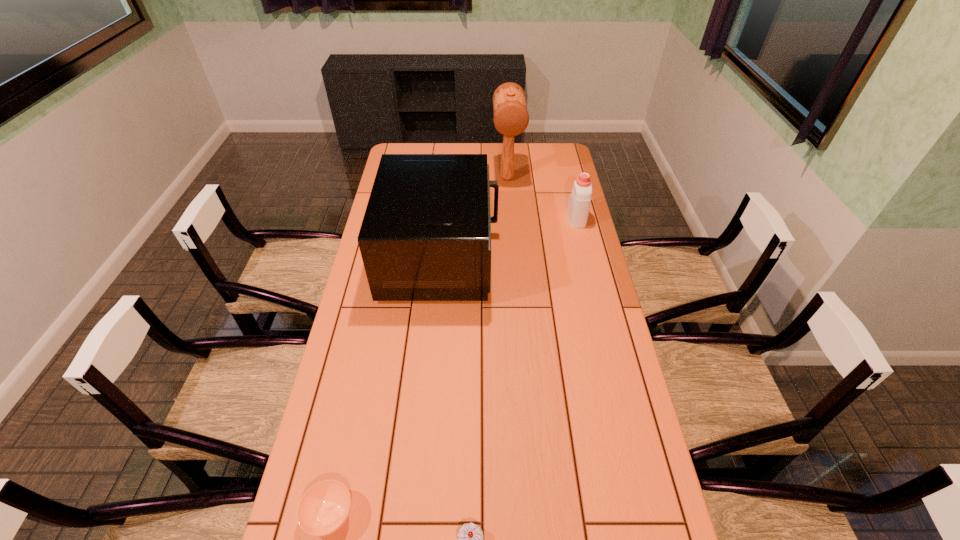
Select which object is the closest to the farthest object. Please provide its 2D coordinates. Your answer should be formatted as a tuple, i.e. [(x, y)], where the tuple contains the x and y coordinates of a point satisfying the conditions above.

[(426, 233)]

You are a GUI agent. You are given a task and a screenshot of the screen. Output one action in this format:
    pyautogui.click(x=<x>, y=<y>)
    Task: Click on the free location that satisfies the following two spatial constraints: 1. on the strike surface of the tallest object; 2. on the front-facing side of the fourth shortest object
    
    Given the screenshot: What is the action you would take?
    pyautogui.click(x=513, y=256)